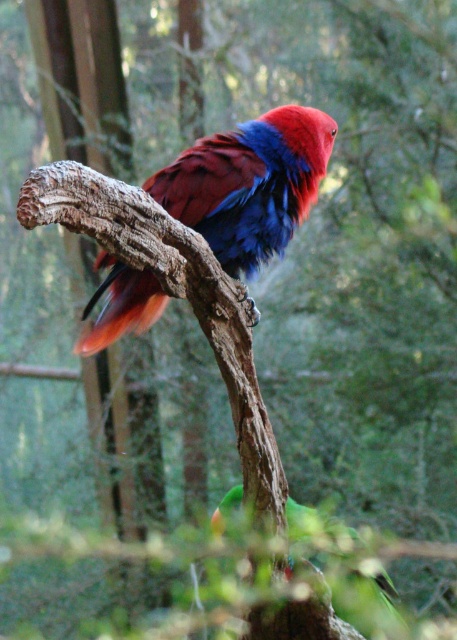
Question: Among these objects, which one is farthest from the camera?

Choices:
 (A) shiny multicolored parrot at center
 (B) green matte parrot at lower center

Answer: (B)

Question: Is shiny multicolored parrot at center above green matte parrot at lower center?

Choices:
 (A) yes
 (B) no

Answer: (A)

Question: Does shiny multicolored parrot at center have a larger size compared to green matte parrot at lower center?

Choices:
 (A) no
 (B) yes

Answer: (B)

Question: Does shiny multicolored parrot at center have a lesser width compared to green matte parrot at lower center?

Choices:
 (A) no
 (B) yes

Answer: (A)

Question: Which object appears farthest from the camera in this image?

Choices:
 (A) green matte parrot at lower center
 (B) shiny multicolored parrot at center

Answer: (A)